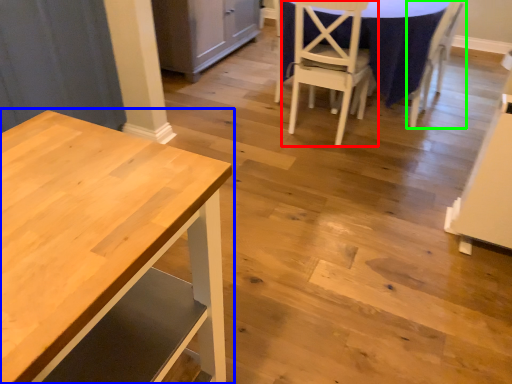
Question: Based on their relative distances, which object is farther from chair (highlighted by a red box)? Choose from table (highlighted by a blue box) and chair (highlighted by a green box).

Choices:
 (A) table
 (B) chair

Answer: (A)